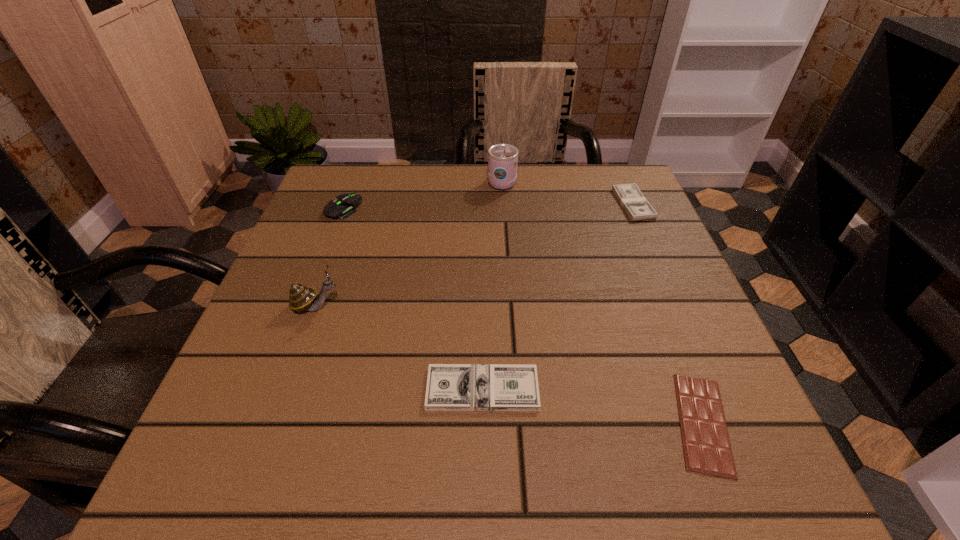
Locate an element on the screen. The image size is (960, 540). cup is located at coordinates (502, 158).

At what (x,y) coordinates should I click in order to perform the action: click on the fourth farthest object. Please return your answer as a coordinate pair (x, y). Image resolution: width=960 pixels, height=540 pixels. Looking at the image, I should click on point(301,298).

Image resolution: width=960 pixels, height=540 pixels. What are the coordinates of `snail` in the screenshot? It's located at (301, 298).

Where is `computer mouse`? This screenshot has width=960, height=540. computer mouse is located at coordinates [x=347, y=203].

Identify the location of the third shortest object. The width and height of the screenshot is (960, 540). (636, 206).

Where is `the taller dollar`? the taller dollar is located at coordinates (636, 206).

This screenshot has height=540, width=960. What are the coordinates of `the nearer dollar` in the screenshot? It's located at (452, 387).

At what (x,y) coordinates should I click in order to perform the action: click on the shorter dollar. Please return your answer as a coordinate pair (x, y). Image resolution: width=960 pixels, height=540 pixels. Looking at the image, I should click on click(452, 387).

Identify the location of chocolate bar. (707, 449).

Find the location of `vacant region located on the face of the second tallest object`. vacant region located on the face of the second tallest object is located at coordinates 528,307.